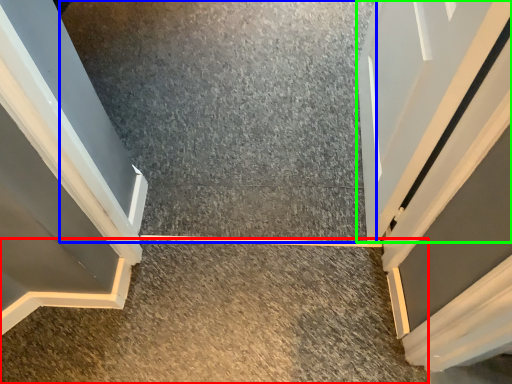
Question: Which is nearer to the concrete (highlighted by a red box)? concrete (highlighted by a blue box) or door (highlighted by a green box).

Choices:
 (A) concrete
 (B) door

Answer: (A)